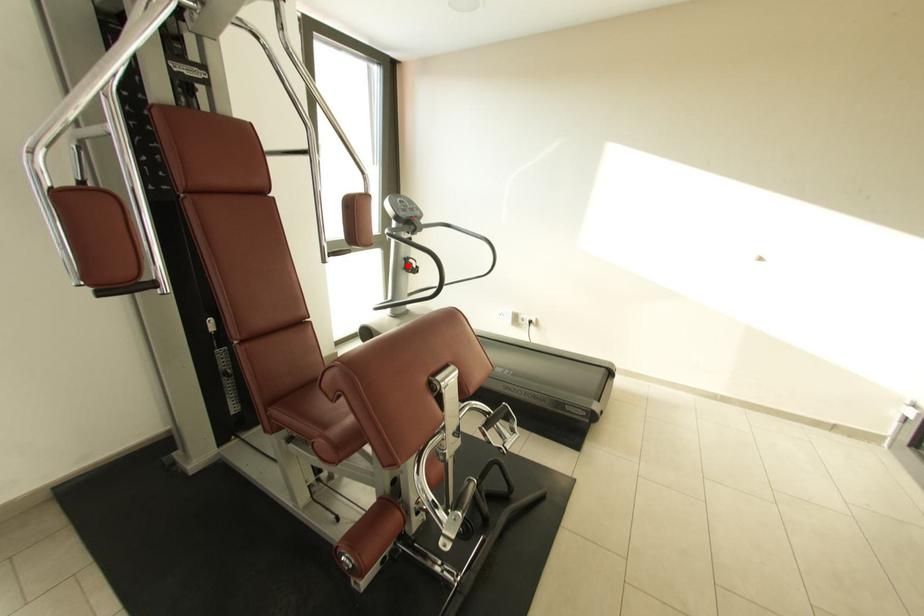
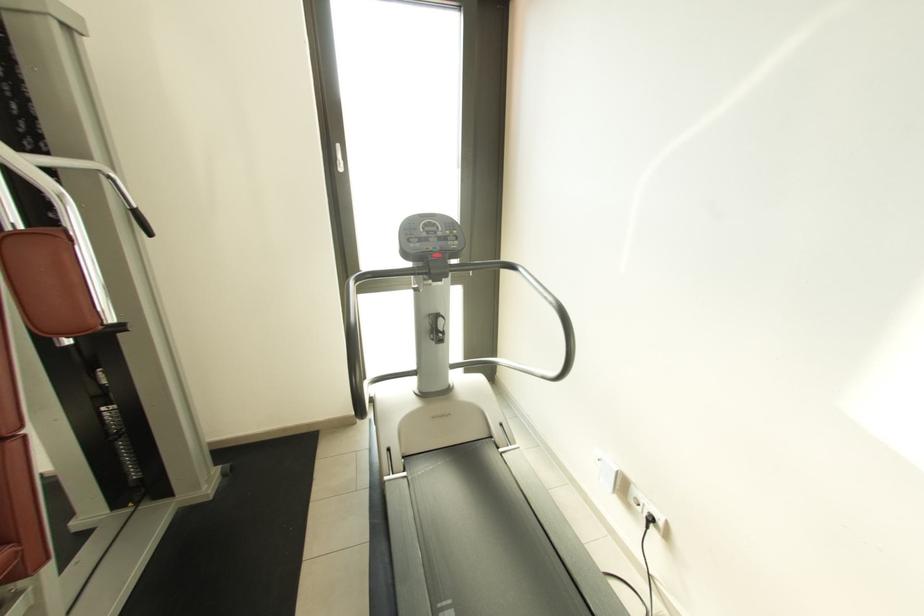
Question: A red point is marked in image1. In image2, is the corresponding 3D point closer to the camera or farther? Reply with the corresponding letter.

Choices:
 (A) The corresponding 3D point is closer.
 (B) The corresponding 3D point is farther.

Answer: (B)